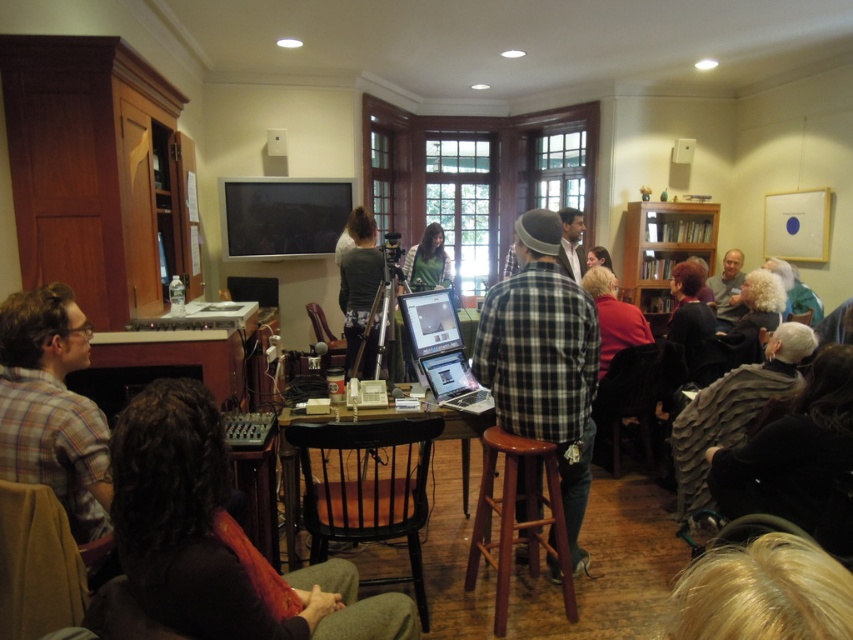
Which is in front, point (254, 636) or point (469, 410)?

Point (254, 636) is more forward.

Where is `dark brown leather guitar at lower left`? dark brown leather guitar at lower left is located at coordinates (218, 538).

Find the location of a particular element. Image resolution: width=853 pixels, height=640 pixels. dark brown leather guitar at lower left is located at coordinates click(x=218, y=538).

Between dark brown leather guitar at lower left and dark gray textured sweater at lower right, which one has less height?

dark brown leather guitar at lower left is shorter.

Is dark brown leather guitar at lower left to the left of dark gray textured sweater at lower right from the viewer's perspective?

Indeed, dark brown leather guitar at lower left is positioned on the left side of dark gray textured sweater at lower right.

Identify the location of dark brown leather guitar at lower left. The width and height of the screenshot is (853, 640). (218, 538).

Does plaid flannel shirt at center come in front of blonde hair at lower right?

No, it is not.

Based on the photo, is plaid flannel shirt at center to the left of blonde hair at lower right from the viewer's perspective?

In fact, plaid flannel shirt at center is to the right of blonde hair at lower right.

Does point (575, 307) lie in front of point (793, 564)?

No, (575, 307) is behind (793, 564).

Image resolution: width=853 pixels, height=640 pixels. Find the location of `plaid flannel shirt at center`. plaid flannel shirt at center is located at coordinates (543, 360).